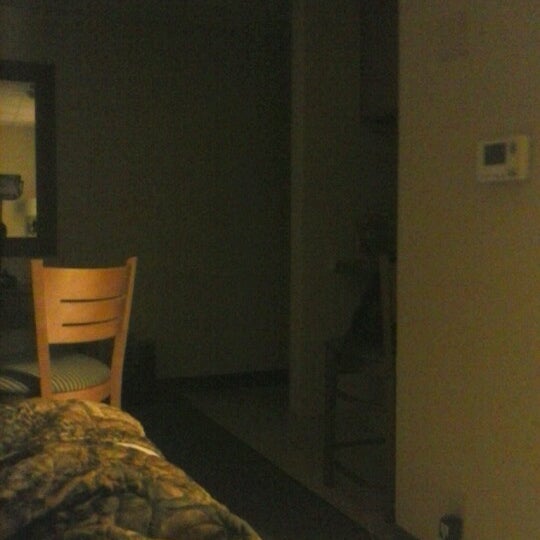
At what (x,y) coordinates should I click in order to perform the action: click on reflections in mirror. Please return your answer as a coordinate pair (x, y). Looking at the image, I should click on (30, 202), (14, 181).